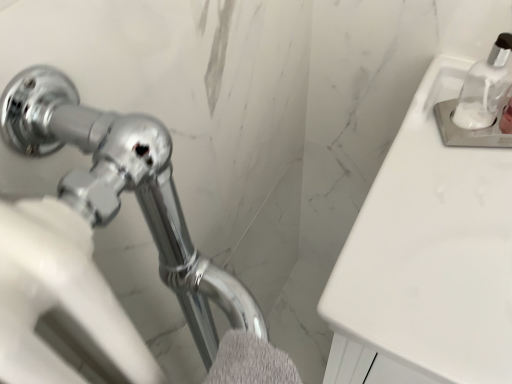
Where is `space that is in front of clear glass soap dispenser at upper right`? space that is in front of clear glass soap dispenser at upper right is located at coordinates (450, 213).